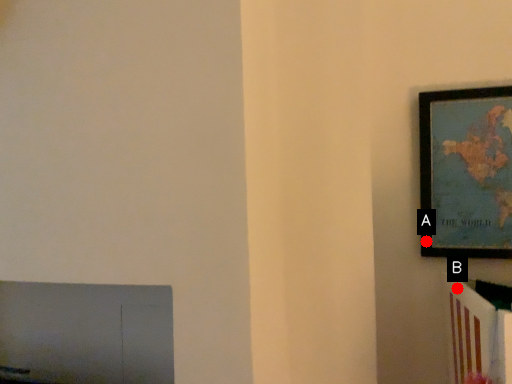
Question: Two points are circled on the image, labeled by A and B beside each circle. Which of the following is the farthest from the observer?

Choices:
 (A) A is further
 (B) B is further

Answer: (A)